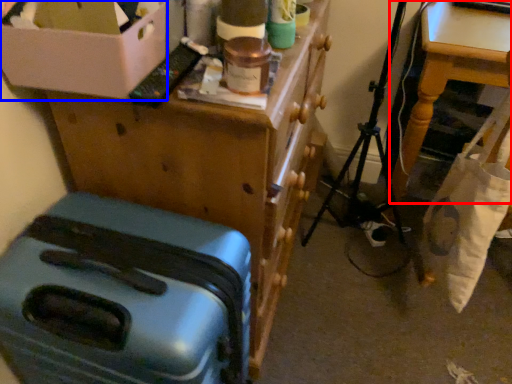
Question: Which object is further to the camera taking this photo, table (highlighted by a red box) or box (highlighted by a blue box)?

Choices:
 (A) table
 (B) box

Answer: (A)